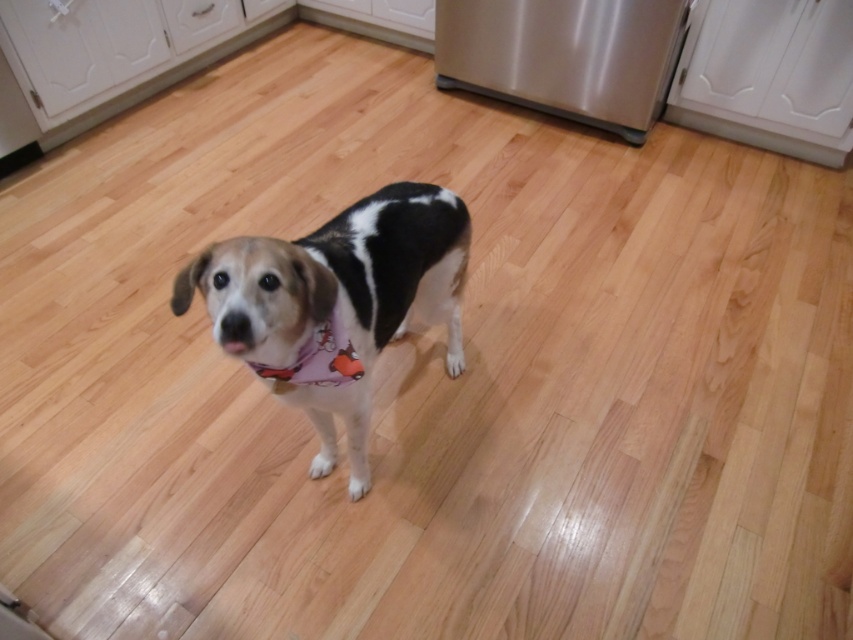
You are standing in the kitchen and want to place a new poster on the wall near the stainless steel refrigerator at center. Based on its position, where should you look to place the poster?

The stainless steel refrigerator at center is located at point (564, 54), so you should place the poster near that coordinate.

You are a photographer setting up a shoot in the kitchen. You have a white fur dog at center and a stainless steel refrigerator at center in the frame. Which object is taller?

The white fur dog at center is taller than the stainless steel refrigerator at center.

You are a delivery person holding a 6.5 feet long package. You need to place it in the kitchen without moving any furniture. Can you fit the package horizontally between the stainless steel refrigerator at center and the nearest wall? Please explain your reasoning.

The stainless steel refrigerator at center is 7.68 feet away from the viewer. However, the distance between the refrigerator and the nearest wall is not specified in the provided information. Therefore, it is impossible to determine if the 6.5 feet long package can fit horizontally between them without additional details about the wall proximity.